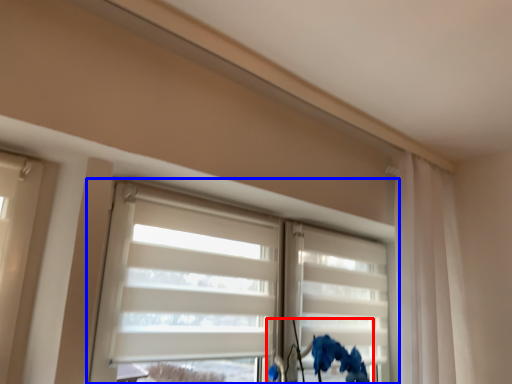
Question: Among these objects, which one is nearest to the camera, floral arrangement (highlighted by a red box) or window (highlighted by a blue box)?

Choices:
 (A) floral arrangement
 (B) window

Answer: (B)